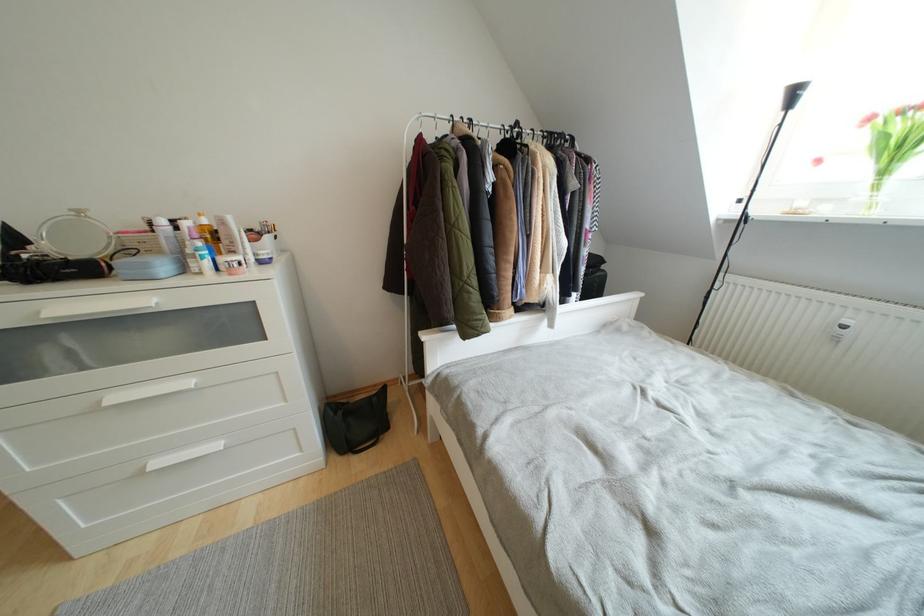
Where would you lift the green tote bag? Please return your answer as a coordinate pair (x, y).

(357, 422)